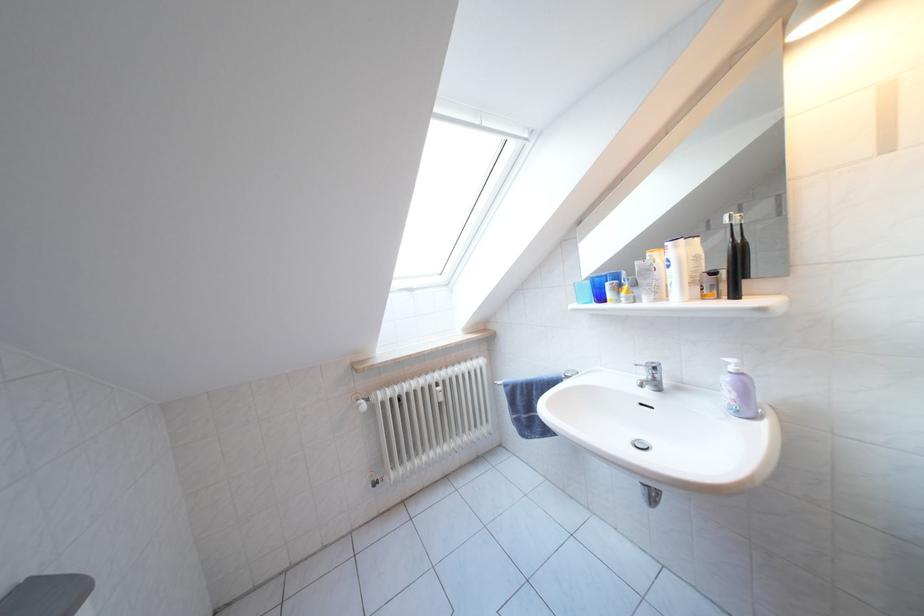
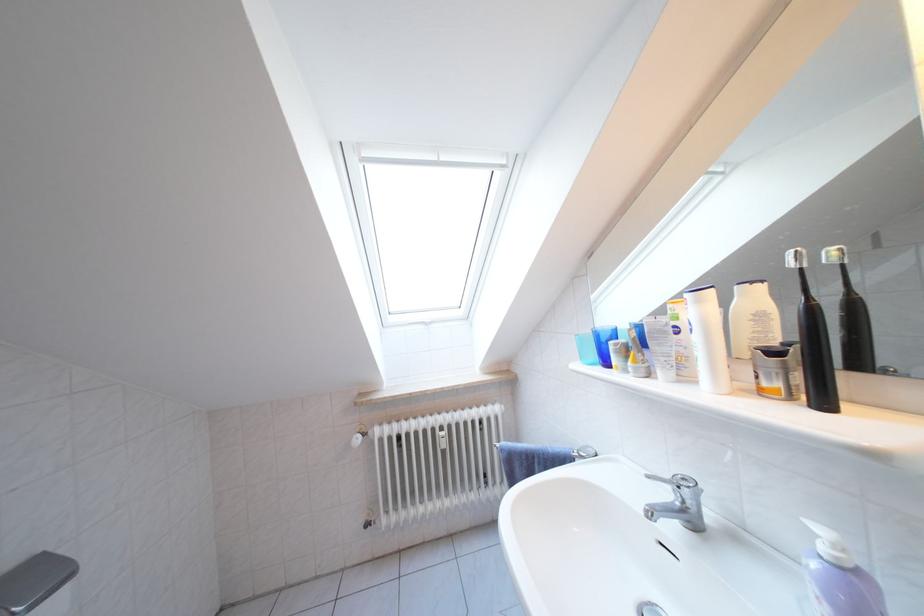
Find the pixel in the second image that matches the point at 652,379 in the first image.

(675, 500)